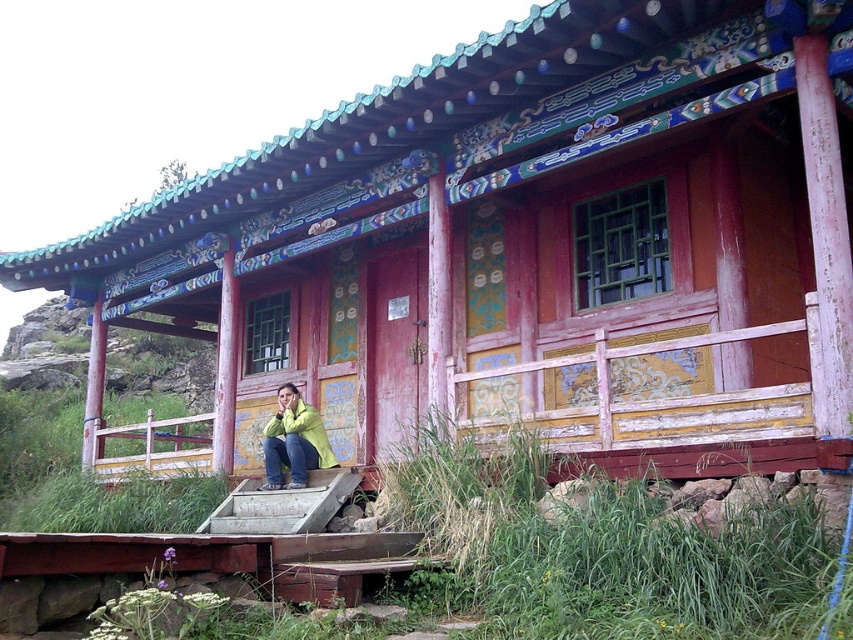
You are a visitor trying to reach the entrance of the traditional building. You see the wooden stairs at center and the green matte jacket at lower center. Which object is bigger and could potentially block your path if you are carrying a large backpack?

The wooden stairs at center is larger in size than the green matte jacket at lower center, so the wooden stairs at center could potentially block your path if you are carrying a large backpack.

You are standing in front of the traditional building and notice two points marked on its roof. The first point is at coordinate point (306, 529) and the second is at point (302, 477). Which of these points is closer to you?

Point (306, 529) is closer to the viewer than point (302, 477).